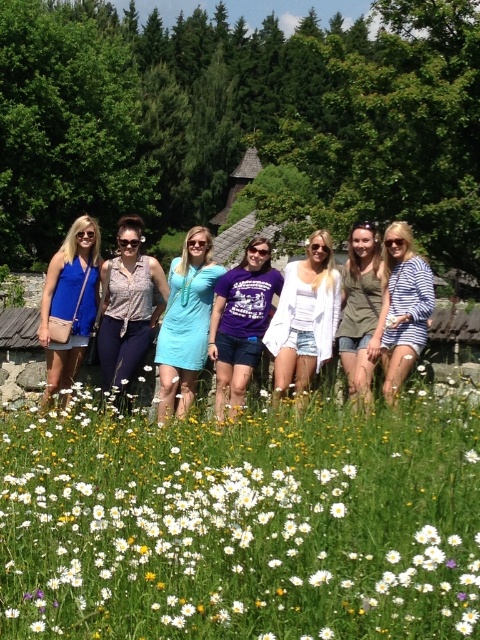
You are a photographer trying to adjust the focus of your camera. You notice two shirts in the image, the matte pink blouse at center and the matte olive green shirt at center. Which one should you focus on first if you want to ensure the taller one is in sharp focus?

The matte pink blouse at center is taller than the matte olive green shirt at center, so you should focus on the matte pink blouse at center first to ensure it is in sharp focus.

You are a photographer trying to focus on the matte pink blouse at center and the white soft daisy at center in the image. Which object should you adjust your camera focus to first if you want to capture both clearly in the same shot?

The matte pink blouse at center is located above the white soft daisy at center. To capture both clearly, focus on the matte pink blouse at center first since it is closer to the camera, ensuring depth of field includes the daisy below it.

You are a photographer trying to capture a closeup of the white soft daisy at center while ensuring the matte pink blouse at center is still visible in the frame. Which direction should you move the camera to achieve this?

Since the matte pink blouse at center is to the left of the white soft daisy at center, you should move the camera to the right to keep both the white soft daisy at center and the matte pink blouse at center in the frame.